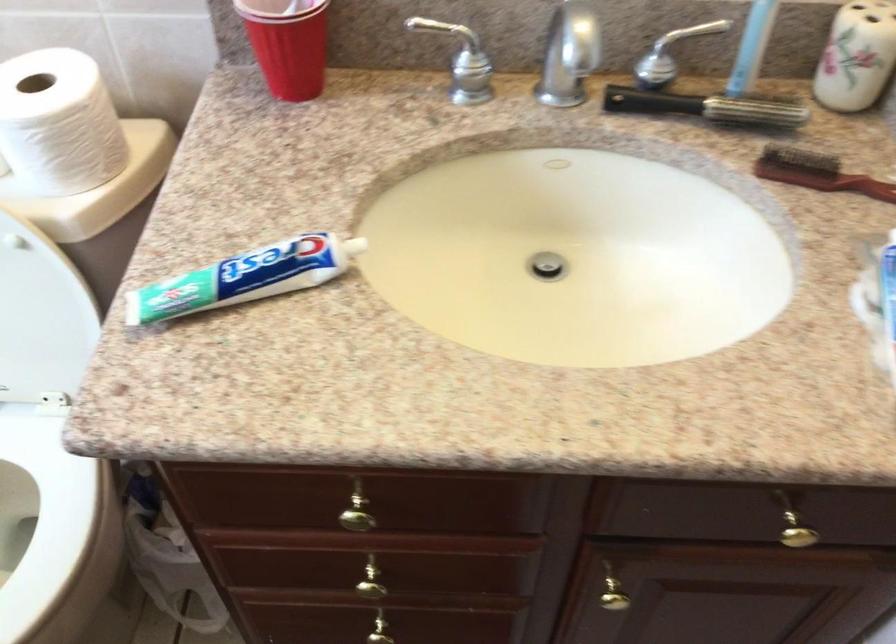
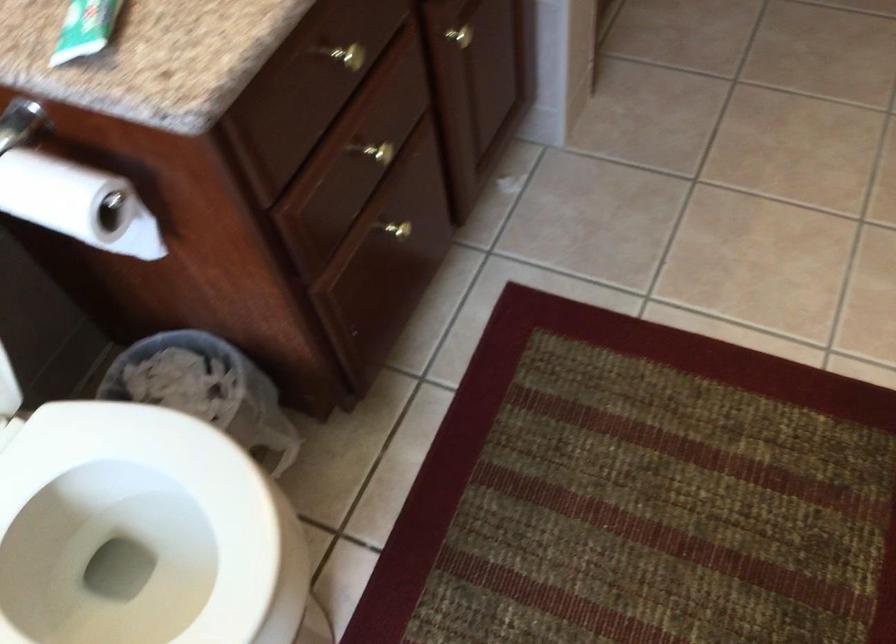
The first image is from the beginning of the video and the second image is from the end. How did the camera likely rotate when shooting the video?

The rotation direction of the camera is right-down.